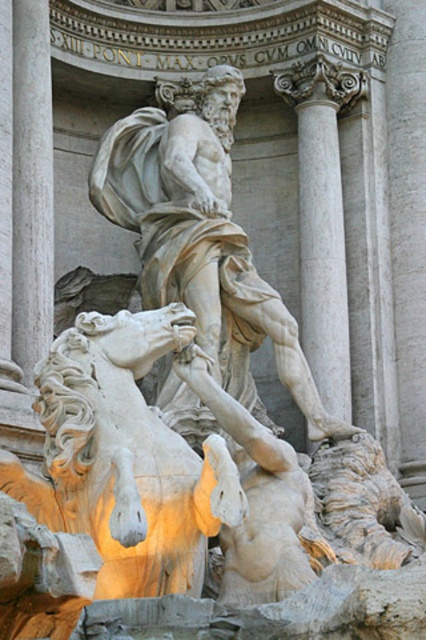
You are an art conservator assessing the stability of the sculpture group. The white marble lion at lower center and the white marble statue at center need to be secured. Which object requires a larger base to prevent tipping over?

The white marble statue at center requires a larger base because it is bigger than the white marble lion at lower center, making it more prone to tipping without proper support.

Based on the photo, you are an art student analyzing the sculpture. You notice the white marble lion at lower center and the white marble statue at center. Which one is taller?

The white marble lion at lower center is shorter than the white marble statue at center, so the white marble statue at center is taller.

You are an art student analyzing the sculpture. You notice the white marble statue at center and the white marble column at upper center. Which object is located to the left of the other?

The white marble statue at center is positioned on the left side of white marble column at upper center.